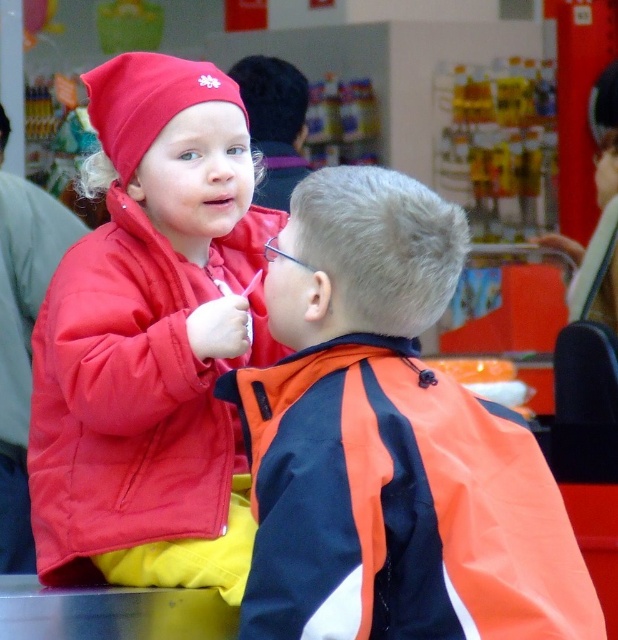
Which of these two, orange fabric jacket at center or short dark hair at upper center, stands shorter?

short dark hair at upper center is shorter.

Which is in front, point (305, 435) or point (290, 145)?

Positioned in front is point (305, 435).

Where is `orange fabric jacket at center`? orange fabric jacket at center is located at coordinates coord(389,444).

Does matte red jacket at upper left have a smaller size compared to blonde hair at upper center?

No, matte red jacket at upper left is not smaller than blonde hair at upper center.

Does matte red jacket at upper left appear on the right side of blonde hair at upper center?

Incorrect, matte red jacket at upper left is not on the right side of blonde hair at upper center.

Locate an element on the screen. matte red jacket at upper left is located at coordinates (151, 340).

This screenshot has width=618, height=640. I want to click on matte red jacket at upper left, so click(151, 340).

Can you confirm if blonde hair at upper center is wider than short dark hair at upper center?

No, blonde hair at upper center is not wider than short dark hair at upper center.

Who is more forward, (462, 237) or (303, 109)?

Positioned in front is point (462, 237).

Between point (365, 202) and point (287, 134), which one is positioned in front?

Point (365, 202)

Where is `blonde hair at upper center`? The image size is (618, 640). blonde hair at upper center is located at coordinates (379, 246).